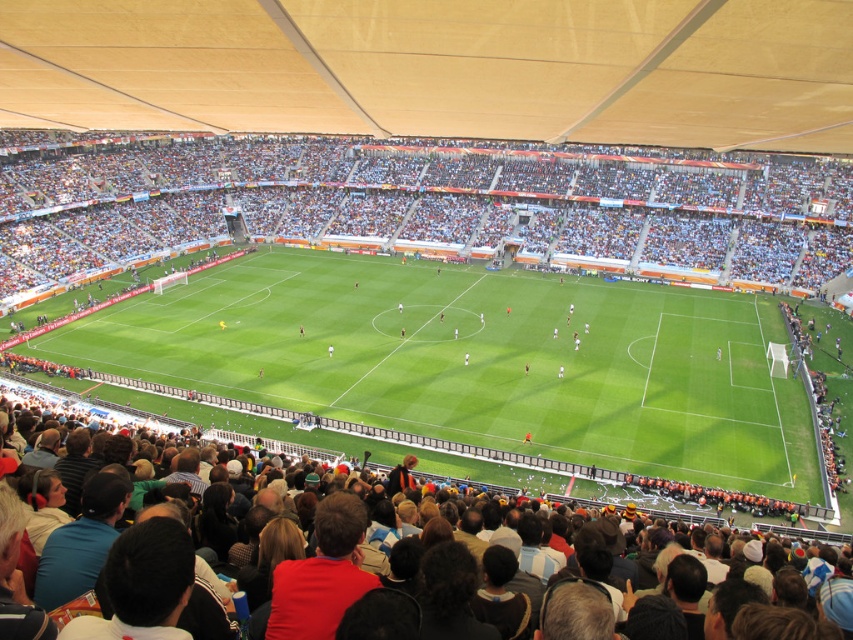
You are a soccer coach standing at the edge of the green grass football field at center. You want to place two cones exactly at the farthest points of the field. How far apart should you place them?

The farthest points of the green grass football field at center are 37.83 meters apart, so you should place the cones 37.83 meters apart.

You are a photographer standing at the edge of the green grass football field at center. You want to take a photo of the dark brown leather jacket at lower center without any obstructions. Given that the field is wider than the jacket, can you position yourself so that the entire jacket fits within the field in your viewfinder?

The green grass football field at center is wider than the dark brown leather jacket at lower center, so yes, you can position yourself to ensure the entire jacket fits within the field in your viewfinder since the field is wider.

Based on the photo, you are a drone operator tasked with capturing aerial footage of the soccer match. Your drone needs to maintain a minimum altitude of 30 meters to avoid interfering with the game. Given the distance between the green grass football field at center and the matte beige canopy at upper center, can your drone safely fly above the canopy without violating the altitude requirement?

The green grass football field at center and the matte beige canopy at upper center are 28.37 meters apart. Since the required minimum altitude is 30 meters, the drone cannot safely fly above the canopy without violating the altitude requirement as the distance between them is less than the required 30 meters.